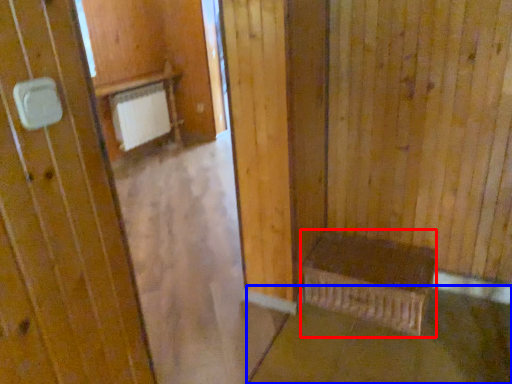
Question: Which of the following is the farthest to the observer, furniture (highlighted by a red box) or concrete (highlighted by a blue box)?

Choices:
 (A) furniture
 (B) concrete

Answer: (A)